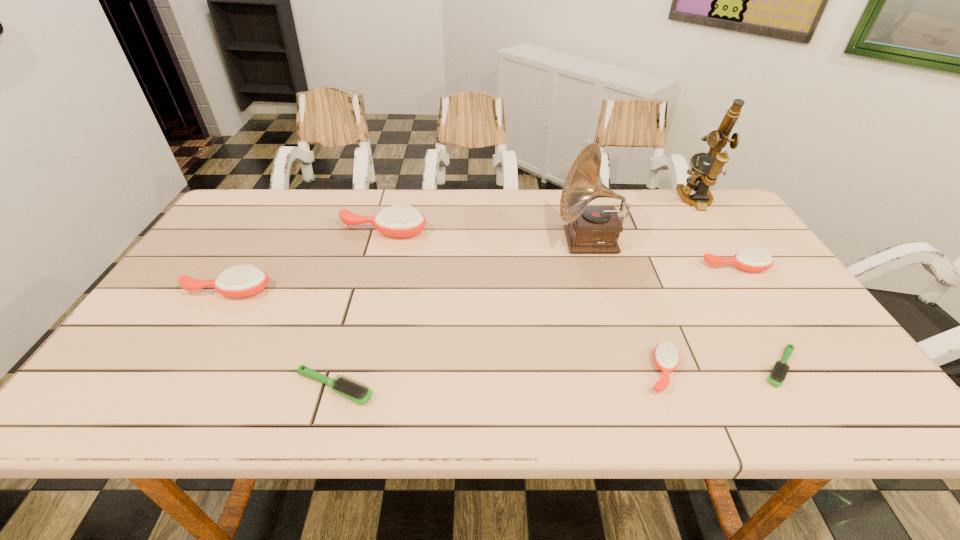
Where is `free space located on the right of the third farthest orange hairbrush`? Image resolution: width=960 pixels, height=540 pixels. free space located on the right of the third farthest orange hairbrush is located at coordinates (412, 291).

Locate an element on the screen. The image size is (960, 540). free region located on the left of the rightmost orange hairbrush is located at coordinates (631, 267).

Where is `vacant space positioned on the left of the nearest orange hairbrush`? vacant space positioned on the left of the nearest orange hairbrush is located at coordinates (470, 372).

Find the location of `vacant space located 0.360m on the back of the left light hairbrush`. vacant space located 0.360m on the back of the left light hairbrush is located at coordinates (371, 263).

Locate an element on the screen. The height and width of the screenshot is (540, 960). free space located 0.380m on the back of the smaller light hairbrush is located at coordinates (706, 246).

At what (x,y) coordinates should I click in order to perform the action: click on microscope that is at the far edge. Please return your answer as a coordinate pair (x, y). Looking at the image, I should click on (703, 176).

Locate an element on the screen. phonograph record located at the far edge is located at coordinates (591, 229).

What are the coordinates of `hairbrush present at the far edge` in the screenshot? It's located at (397, 221).

This screenshot has height=540, width=960. In order to click on object at the left edge in this screenshot , I will do `click(240, 281)`.

Locate an element on the screen. The height and width of the screenshot is (540, 960). microscope positioned at the right edge is located at coordinates (703, 176).